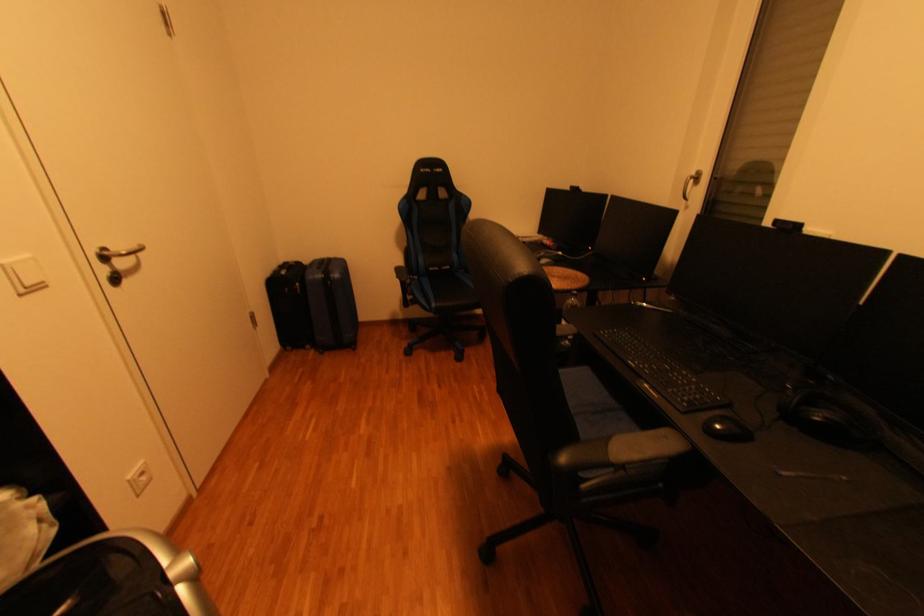
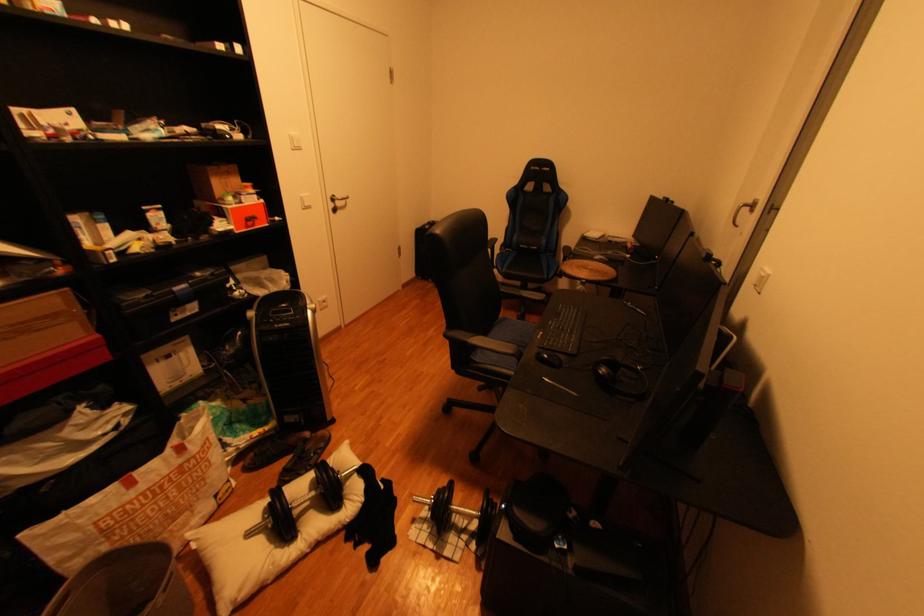
Find the pixel in the second image that matches point 441,270 in the first image.

(531, 246)